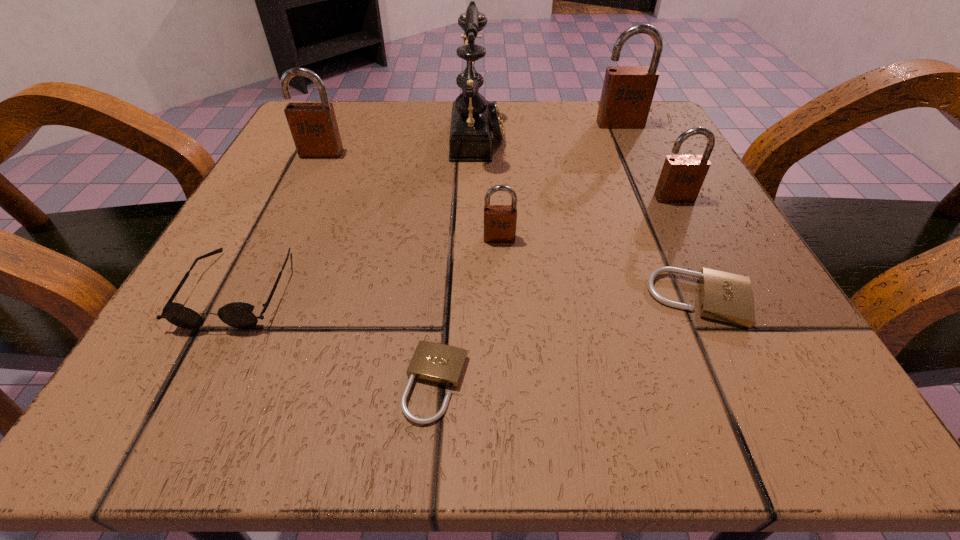
Locate an element on the screen. the farther beige padlock is located at coordinates (723, 296).

Identify the location of the fifth farthest padlock. (723, 296).

Identify the location of the nearest padlock. (441, 364).

Find the location of `the smaller beige padlock`. the smaller beige padlock is located at coordinates (441, 364).

At what (x,y) coordinates should I click in order to perform the action: click on free space located on the dial of the black telephone. Please return your answer as a coordinate pair (x, y). The height and width of the screenshot is (540, 960). Looking at the image, I should click on (599, 136).

Where is `free region located on the front-facing side of the farthest padlock`? This screenshot has width=960, height=540. free region located on the front-facing side of the farthest padlock is located at coordinates (x=642, y=172).

Find the location of a particular element. free region located 0.320m on the front-facing side of the second farthest brown padlock is located at coordinates (255, 292).

Identify the location of free space located on the front-facing side of the fourth shortest padlock. This screenshot has height=540, width=960. (780, 403).

The width and height of the screenshot is (960, 540). Find the location of `vacant space located on the front-facing side of the nearest brown padlock`. vacant space located on the front-facing side of the nearest brown padlock is located at coordinates (507, 406).

Locate an element on the screen. This screenshot has width=960, height=540. free space located on the front-facing side of the sixth tallest object is located at coordinates (194, 376).